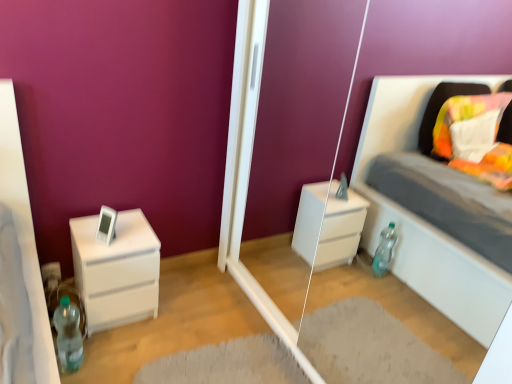
Question: In terms of width, does transparent glass door at center look wider or thinner when compared to white matte chest of drawers at left?

Choices:
 (A) thin
 (B) wide

Answer: (A)

Question: Is point (238, 1) closer or farther from the camera than point (150, 226)?

Choices:
 (A) closer
 (B) farther

Answer: (A)

Question: Which of these objects is positioned closest to the transparent glass door at center?

Choices:
 (A) translucent plastic bottle at lower left
 (B) white matte chest of drawers at left

Answer: (B)

Question: Which object is the closest to the translucent plastic bottle at lower left?

Choices:
 (A) transparent glass door at center
 (B) white matte chest of drawers at left

Answer: (B)